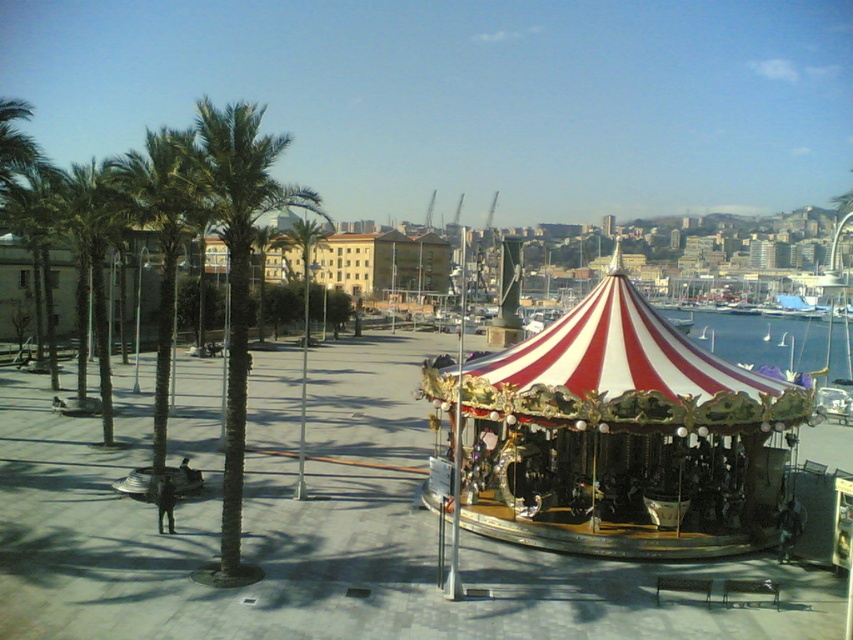
Question: Is red and white striped carousel at center positioned at the back of green textured palm tree at left?

Choices:
 (A) yes
 (B) no

Answer: (B)

Question: Which point is closer to the camera?

Choices:
 (A) blue water at center
 (B) green textured palm tree at left
 (C) red and white striped carousel at center

Answer: (C)

Question: Is green textured palm tree at left above blue water at center?

Choices:
 (A) yes
 (B) no

Answer: (A)

Question: Is green leafy palm tree at left wider than blue water at center?

Choices:
 (A) no
 (B) yes

Answer: (A)

Question: Which point is farther to the camera?

Choices:
 (A) (229, 330)
 (B) (722, 456)
 (C) (815, 330)

Answer: (C)

Question: Among these objects, which one is nearest to the camera?

Choices:
 (A) green leafy palm tree at left
 (B) green textured palm tree at left
 (C) red and white striped carousel at center

Answer: (C)